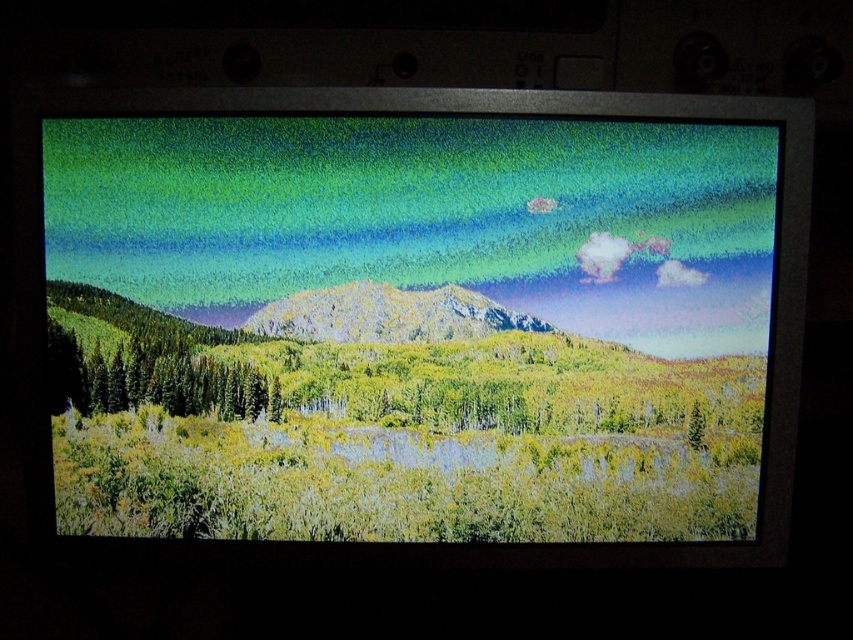
Which is behind, point (662, 184) or point (120, 352)?

Positioned behind is point (120, 352).

Who is higher up, green matte landscape at center or green matte trees at left?

green matte landscape at center is above.

Is point (631, 268) behind point (136, 330)?

Yes, it is behind point (136, 330).

This screenshot has height=640, width=853. Identify the location of green matte landscape at center. tap(408, 326).

Is green matte landscape at center above rocky mountain at center?

Actually, green matte landscape at center is below rocky mountain at center.

Is green matte landscape at center thinner than rocky mountain at center?

No.

What do you see at coordinates (408, 326) in the screenshot? I see `green matte landscape at center` at bounding box center [408, 326].

The height and width of the screenshot is (640, 853). Identify the location of green matte landscape at center. (408, 326).

Who is lower down, green matte trees at left or rocky mountain at center?

green matte trees at left is below.

Which is more to the left, green matte trees at left or rocky mountain at center?

From the viewer's perspective, green matte trees at left appears more on the left side.

Which is in front, point (67, 342) or point (306, 326)?

Point (67, 342)

The height and width of the screenshot is (640, 853). Find the location of `green matte trees at left`. green matte trees at left is located at coordinates (154, 376).